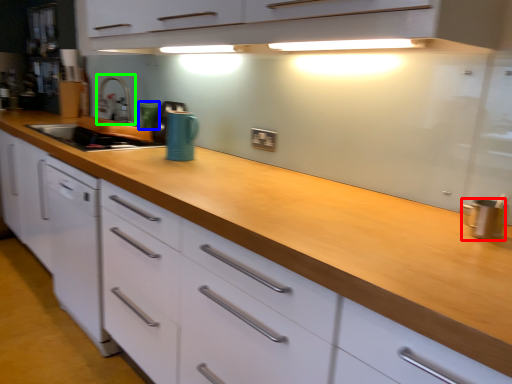
Question: Based on their relative distances, which object is farther from kitchen appliance (highlighted by a red box)? Choose from appliance (highlighted by a blue box) and faucet (highlighted by a green box).

Choices:
 (A) appliance
 (B) faucet

Answer: (B)